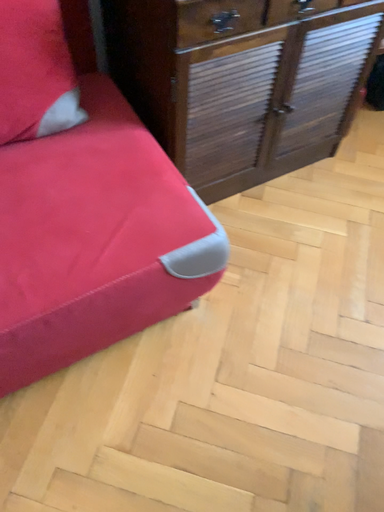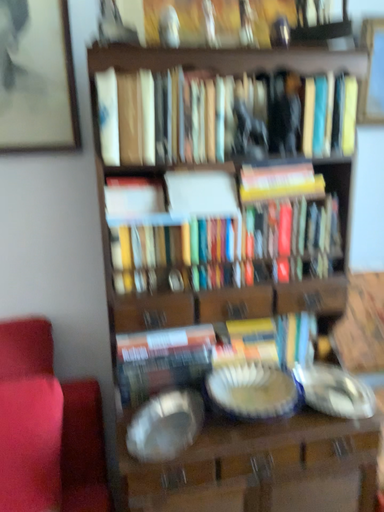
Question: How did the camera likely rotate when shooting the video?

Choices:
 (A) rotated left
 (B) rotated right

Answer: (A)